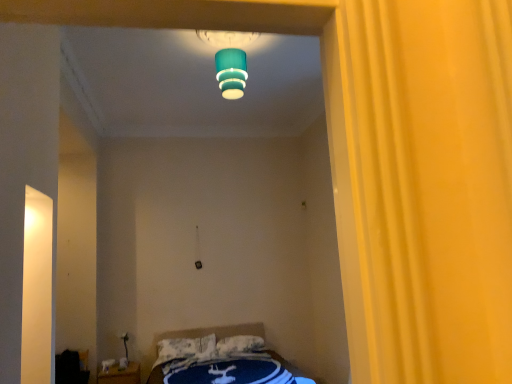
Describe the element at coordinates (70, 368) in the screenshot. I see `black fabric bag at lower left` at that location.

The image size is (512, 384). What do you see at coordinates (239, 345) in the screenshot?
I see `white soft pillow at lower center, the first pillow when ordered from right to left` at bounding box center [239, 345].

The height and width of the screenshot is (384, 512). Describe the element at coordinates (120, 374) in the screenshot. I see `wooden nightstand at lower left` at that location.

Locate an element on the screen. Image resolution: width=512 pixels, height=384 pixels. black fabric bag at lower left is located at coordinates (70, 368).

Based on their positions, is blue fabric bed at lower center located to the left or right of teal matte lampshade at upper center?

From the image, it's evident that blue fabric bed at lower center is to the left of teal matte lampshade at upper center.

Is blue fabric bed at lower center located outside teal matte lampshade at upper center?

Yes.

Is blue fabric bed at lower center looking in the opposite direction of teal matte lampshade at upper center?

No.

Considering the sizes of blue fabric bed at lower center and white soft pillow at lower center, the first pillow when ordered from right to left, in the image, is blue fabric bed at lower center bigger or smaller than white soft pillow at lower center, the first pillow when ordered from right to left,?

Clearly, blue fabric bed at lower center is larger in size than white soft pillow at lower center, the first pillow when ordered from right to left.

Considering the relative sizes of blue fabric bed at lower center and white soft pillow at lower center, the 2th pillow when ordered from left to right, in the image provided, is blue fabric bed at lower center taller than white soft pillow at lower center, the 2th pillow when ordered from left to right,?

Indeed, blue fabric bed at lower center has a greater height compared to white soft pillow at lower center, the 2th pillow when ordered from left to right.

You are a GUI agent. You are given a task and a screenshot of the screen. Output one action in this format:
    pyautogui.click(x=<x>, y=<y>)
    Task: Click on the 2nd pillow behind when counting from the blue fabric bed at lower center
    
    Given the screenshot: What is the action you would take?
    pyautogui.click(x=239, y=345)

Is wooden nightstand at lower left in contact with blue fabric bed at lower center?

No, wooden nightstand at lower left is not beside blue fabric bed at lower center.

Does point (140, 382) appear closer or farther from the camera than point (249, 331)?

Point (140, 382) is closer to the camera than point (249, 331).

From the image's perspective, does wooden nightstand at lower left appear higher than blue fabric bed at lower center?

No, from the image's perspective, wooden nightstand at lower left is not above blue fabric bed at lower center.

Is teal matte lampshade at upper center shorter than white soft pillow at lower center, the 2th pillow when ordered from left to right?

No, teal matte lampshade at upper center is not shorter than white soft pillow at lower center, the 2th pillow when ordered from left to right.

The image size is (512, 384). What are the coordinates of `pillow on the right side of teal matte lampshade at upper center` in the screenshot? It's located at (239, 345).

Is teal matte lampshade at upper center at the left side of white soft pillow at lower center, the 2th pillow when ordered from left to right?

Yes.

Is teal matte lampshade at upper center not inside white soft pillow at lower center, the 2th pillow when ordered from left to right?

Yes, teal matte lampshade at upper center is not within white soft pillow at lower center, the 2th pillow when ordered from left to right.

Is teal matte lampshade at upper center further to the viewer compared to black fabric bag at lower left?

No, teal matte lampshade at upper center is closer to the viewer.

Is teal matte lampshade at upper center facing towards black fabric bag at lower left?

No, teal matte lampshade at upper center does not turn towards black fabric bag at lower left.

Which object is wider, teal matte lampshade at upper center or black fabric bag at lower left?

teal matte lampshade at upper center.

Is teal matte lampshade at upper center placed right next to black fabric bag at lower left?

teal matte lampshade at upper center and black fabric bag at lower left are clearly separated.

Does point (248, 349) appear closer or farther from the camera than point (101, 377)?

Point (248, 349) is positioned farther from the camera compared to point (101, 377).

Measure the distance from white soft pillow at lower center, the 2th pillow when ordered from left to right, to wooden nightstand at lower left.

white soft pillow at lower center, the 2th pillow when ordered from left to right, and wooden nightstand at lower left are 3.66 feet apart.

From a real-world perspective, who is located lower, white soft pillow at lower center, the 2th pillow when ordered from left to right, or wooden nightstand at lower left?

wooden nightstand at lower left is physically lower.

Considering the positions of objects white soft pillow at lower center, the first pillow when ordered from right to left, and wooden nightstand at lower left in the image provided, who is in front, white soft pillow at lower center, the first pillow when ordered from right to left, or wooden nightstand at lower left?

wooden nightstand at lower left is more forward.

Does point (162, 363) lie behind point (74, 362)?

Yes, it is.

Which of these two, white textured pillow at center, which is the second pillow in right-to-left order, or black fabric bag at lower left, stands shorter?

Standing shorter between the two is white textured pillow at center, which is the second pillow in right-to-left order.

Looking at their sizes, would you say white textured pillow at center, the 1th pillow positioned from the left, is wider or thinner than black fabric bag at lower left?

Considering their sizes, white textured pillow at center, the 1th pillow positioned from the left, looks slimmer than black fabric bag at lower left.

Where is `bed that is behind the teal matte lampshade at upper center`? The height and width of the screenshot is (384, 512). bed that is behind the teal matte lampshade at upper center is located at coordinates (220, 358).

You are a GUI agent. You are given a task and a screenshot of the screen. Output one action in this format:
    pyautogui.click(x=<x>, y=<y>)
    Task: Click on the pillow that is the 2nd object located above the blue fabric bed at lower center (from the image's perspective)
    
    Given the screenshot: What is the action you would take?
    pyautogui.click(x=239, y=345)

Estimate the real-world distances between objects in this image. Which object is further from white textured pillow at center, which is the second pillow in right-to-left order, wooden nightstand at lower left or teal matte lampshade at upper center?

teal matte lampshade at upper center is positioned further to the anchor white textured pillow at center, which is the second pillow in right-to-left order.

Estimate the real-world distances between objects in this image. Which object is further from blue fabric bed at lower center, wooden nightstand at lower left or white soft pillow at lower center, the 2th pillow when ordered from left to right?

wooden nightstand at lower left.

From the image, which object appears to be nearer to blue fabric bed at lower center, white soft pillow at lower center, the first pillow when ordered from right to left, or teal matte lampshade at upper center?

white soft pillow at lower center, the first pillow when ordered from right to left, lies closer to blue fabric bed at lower center than the other object.

Estimate the real-world distances between objects in this image. Which object is further from black fabric bag at lower left, white soft pillow at lower center, the 2th pillow when ordered from left to right, or teal matte lampshade at upper center?

teal matte lampshade at upper center lies further to black fabric bag at lower left than the other object.

Consider the image. Looking at the image, which one is located further to blue fabric bed at lower center, black fabric bag at lower left or white soft pillow at lower center, the first pillow when ordered from right to left?

Among the two, black fabric bag at lower left is located further to blue fabric bed at lower center.

Considering their positions, is teal matte lampshade at upper center positioned further to black fabric bag at lower left than white textured pillow at center, the 1th pillow positioned from the left?

teal matte lampshade at upper center is positioned further to the anchor black fabric bag at lower left.

Considering their positions, is white soft pillow at lower center, the 2th pillow when ordered from left to right, positioned further to blue fabric bed at lower center than black fabric bag at lower left?

Based on the image, black fabric bag at lower left appears to be further to blue fabric bed at lower center.

Based on their spatial positions, is black fabric bag at lower left or blue fabric bed at lower center closer to teal matte lampshade at upper center?

blue fabric bed at lower center is closer to teal matte lampshade at upper center.

This screenshot has width=512, height=384. What are the coordinates of `furniture between teal matte lampshade at upper center and wooden nightstand at lower left vertically` in the screenshot? It's located at 70,368.

I want to click on nightstand between black fabric bag at lower left and white soft pillow at lower center, the 2th pillow when ordered from left to right, in the horizontal direction, so click(x=120, y=374).

Image resolution: width=512 pixels, height=384 pixels. Find the location of `bed situated between black fabric bag at lower left and white soft pillow at lower center, the 2th pillow when ordered from left to right, from left to right`. bed situated between black fabric bag at lower left and white soft pillow at lower center, the 2th pillow when ordered from left to right, from left to right is located at coordinates (220, 358).

The width and height of the screenshot is (512, 384). Identify the location of furniture between blue fabric bed at lower center and white textured pillow at center, which is the second pillow in right-to-left order, along the z-axis. click(70, 368).